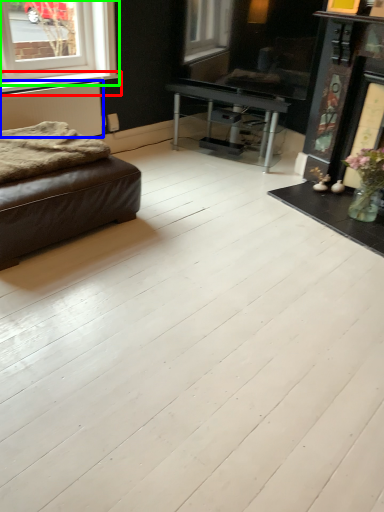
Question: Which object is the farthest from window sill (highlighted by a red box)? Choose among these: radiator (highlighted by a blue box) or window (highlighted by a green box).

Choices:
 (A) radiator
 (B) window

Answer: (B)